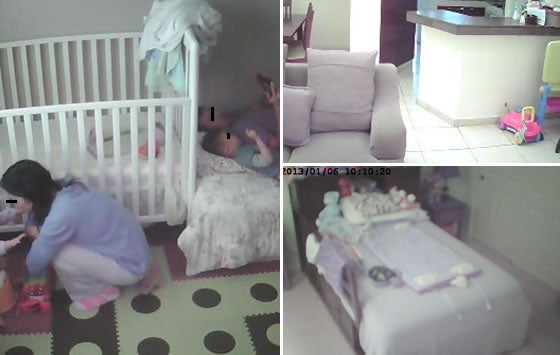
Locate an element on the screen. The height and width of the screenshot is (355, 560). blanket is located at coordinates (196, 28).